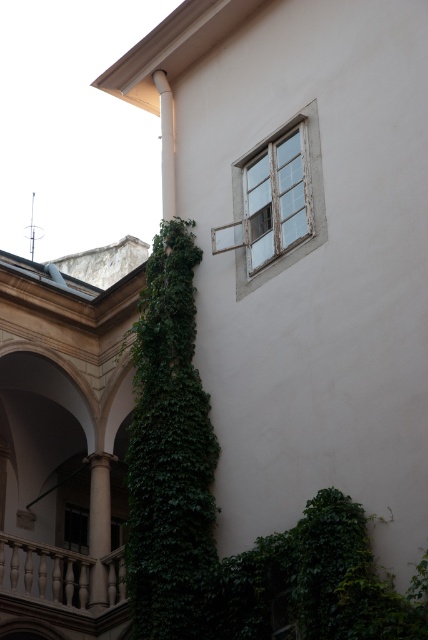
Question: Does green leafy ivy at lower right have a lesser width compared to smooth stone column at lower left?

Choices:
 (A) no
 (B) yes

Answer: (A)

Question: Which point is farther to the camera?

Choices:
 (A) white marble balustrade at lower left
 (B) smooth stone column at lower left

Answer: (A)

Question: Among these objects, which one is nearest to the camera?

Choices:
 (A) white marble balustrade at lower left
 (B) green leafy ivy at left

Answer: (B)

Question: Is white wooden window at upper right below smooth stone column at lower left?

Choices:
 (A) yes
 (B) no

Answer: (B)

Question: Which point is closer to the camera?

Choices:
 (A) smooth stone column at lower left
 (B) white marble balustrade at lower left
 (C) white wooden window at upper right

Answer: (C)

Question: Does green leafy ivy at lower right come in front of smooth stone column at lower left?

Choices:
 (A) no
 (B) yes

Answer: (B)